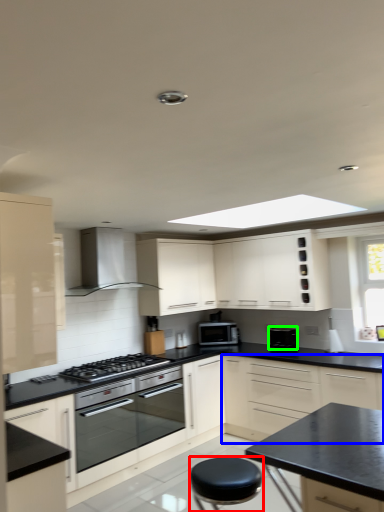
Question: Which object is the closest to the stool (highlighted by a red box)? Choose among these: cabinetry (highlighted by a blue box) or appliance (highlighted by a green box).

Choices:
 (A) cabinetry
 (B) appliance

Answer: (A)